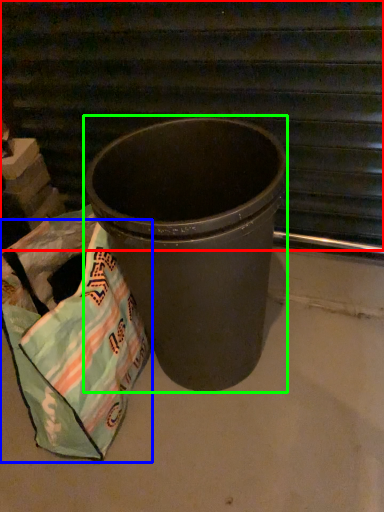
Question: Based on their relative distances, which object is farther from stairwell (highlighted by a red box)? Choose from grocery bag (highlighted by a blue box) and waste container (highlighted by a green box).

Choices:
 (A) grocery bag
 (B) waste container

Answer: (A)